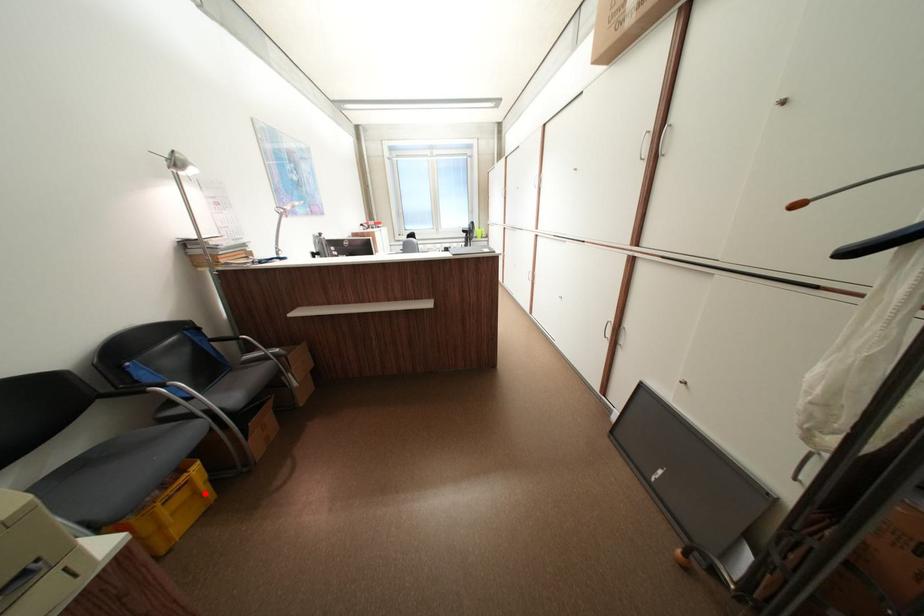
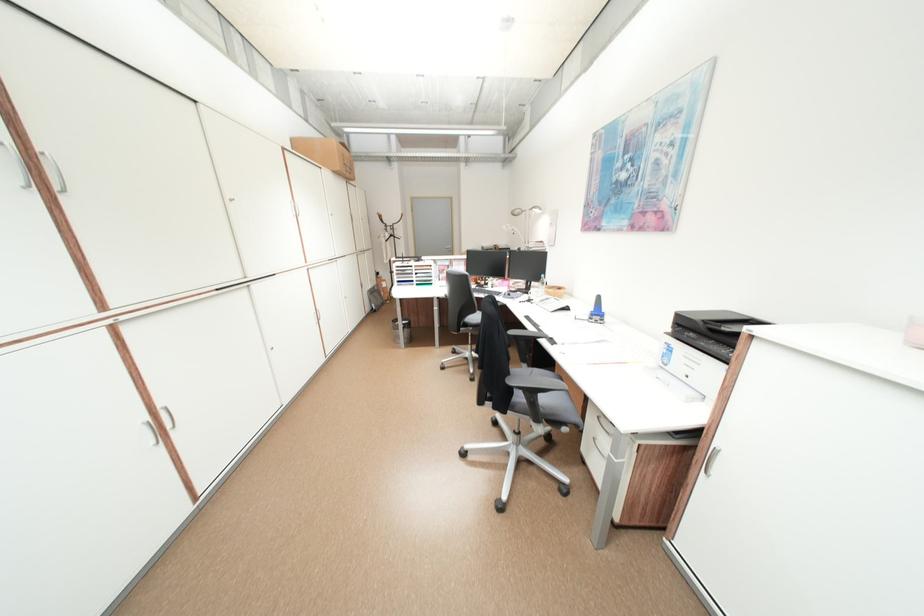
Question: I am providing you with two images of the same scene from different viewpoints. A red point is marked on the first image. Is the red point's position out of view in image 2?

Choices:
 (A) Yes
 (B) No

Answer: (A)